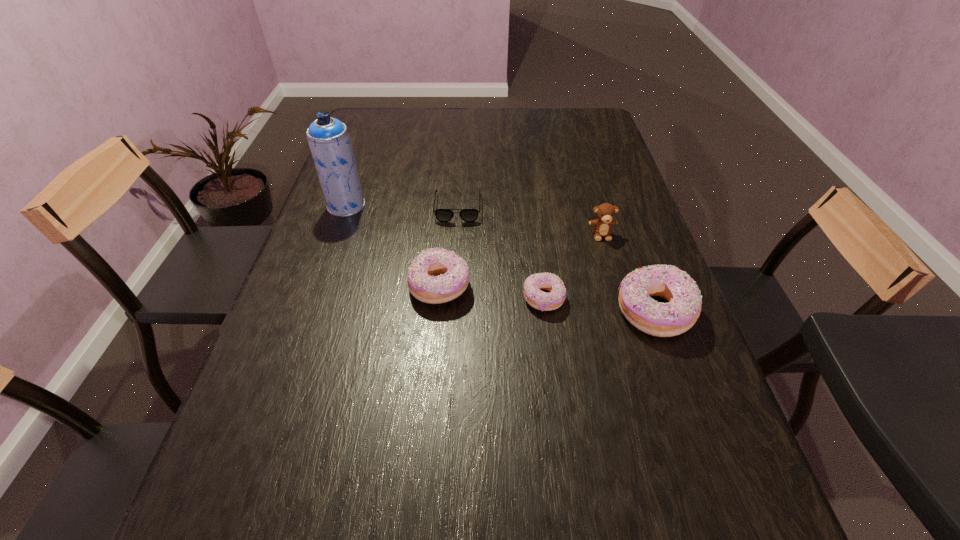
The height and width of the screenshot is (540, 960). Identify the location of vacant spot to place a doughnut on the left. (341, 275).